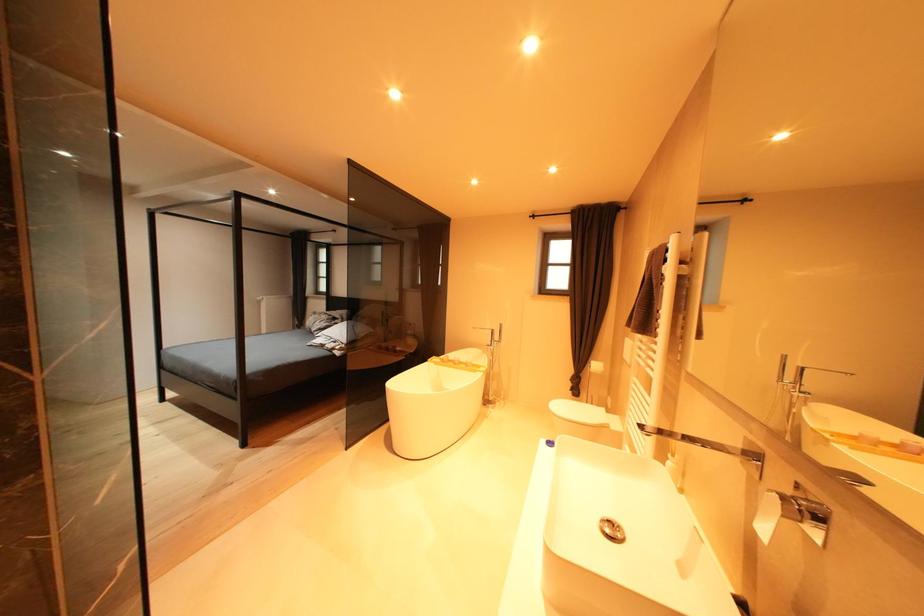
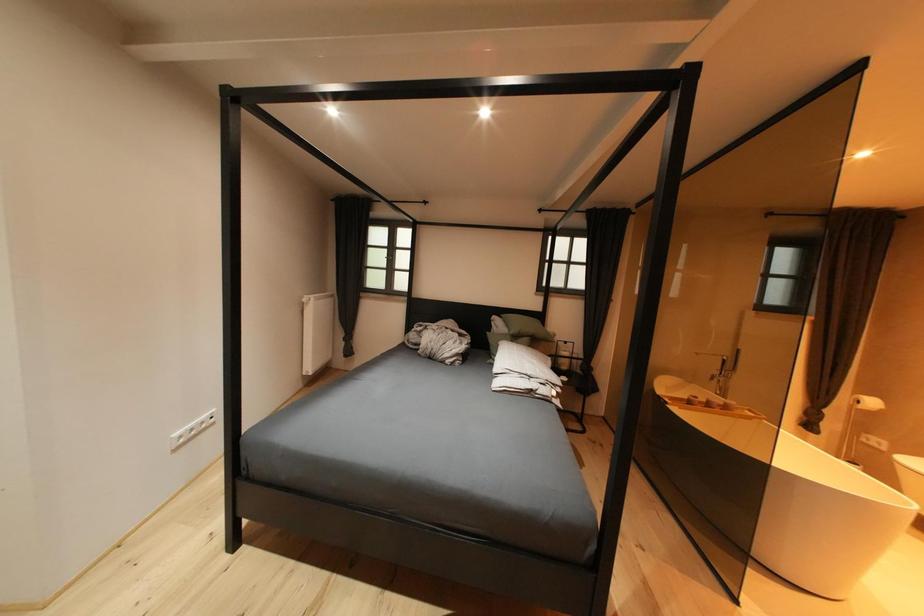
The images are taken continuously from a first-person perspective. In which direction are you moving?

The movement direction of the cameraman is left, forward.